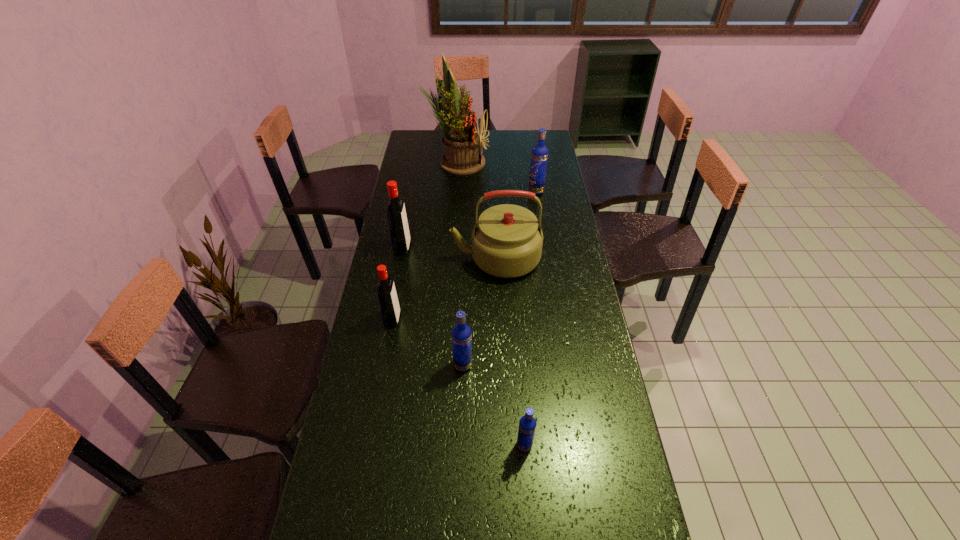
The height and width of the screenshot is (540, 960). What are the coordinates of `the nearer red vodka` in the screenshot? It's located at (388, 301).

The width and height of the screenshot is (960, 540). I want to click on the nearest vodka, so click(527, 425).

In order to click on the nearest object in this screenshot , I will do `click(527, 425)`.

Where is `free point located 0.250m in front of the tallest object with the fan visible`? This screenshot has width=960, height=540. free point located 0.250m in front of the tallest object with the fan visible is located at coordinates (540, 161).

Where is `vacant space located at the spout of the kettle`? vacant space located at the spout of the kettle is located at coordinates (438, 258).

Where is `vacant space located 0.160m at the spout of the kettle`? This screenshot has width=960, height=540. vacant space located 0.160m at the spout of the kettle is located at coordinates (409, 258).

You are a GUI agent. You are given a task and a screenshot of the screen. Output one action in this format:
    pyautogui.click(x=<x>, y=<y>)
    Task: Click on the vacant space situated at the spout of the kettle
    
    Given the screenshot: What is the action you would take?
    pyautogui.click(x=430, y=258)

Locate an element on the screen. free spot located 0.210m on the front of the farthest blue vodka is located at coordinates (x=541, y=225).

Locate an element on the screen. vacant space located on the front and back of the fourth nearest vodka is located at coordinates (464, 248).

This screenshot has height=540, width=960. Find the location of `vacant space located 0.220m on the right of the second farthest blue vodka`. vacant space located 0.220m on the right of the second farthest blue vodka is located at coordinates (544, 365).